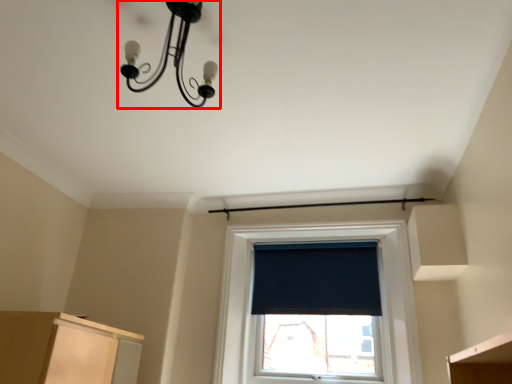
Question: Observing the image, what is the correct spatial positioning of lamp (annotated by the red box) in reference to window screen?

Choices:
 (A) left
 (B) right

Answer: (A)